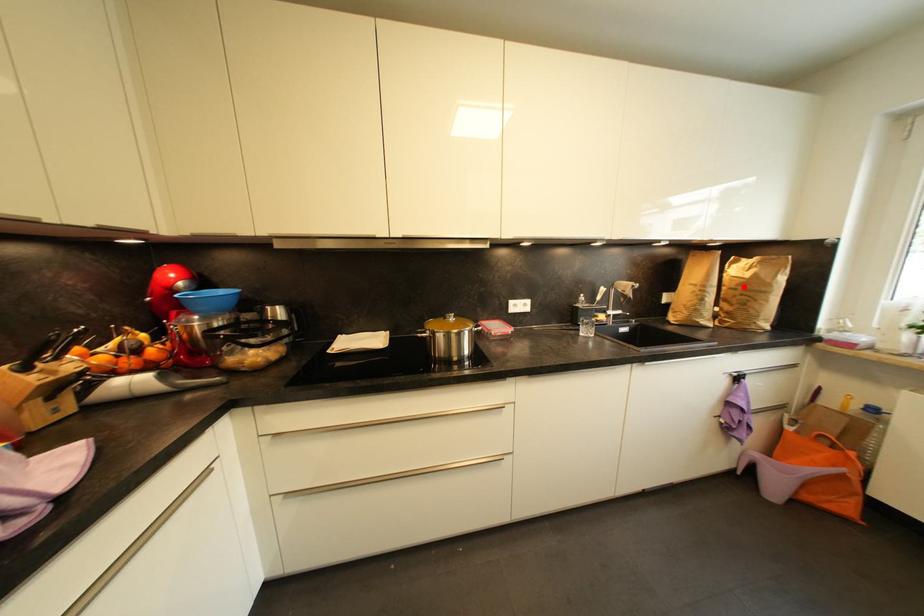
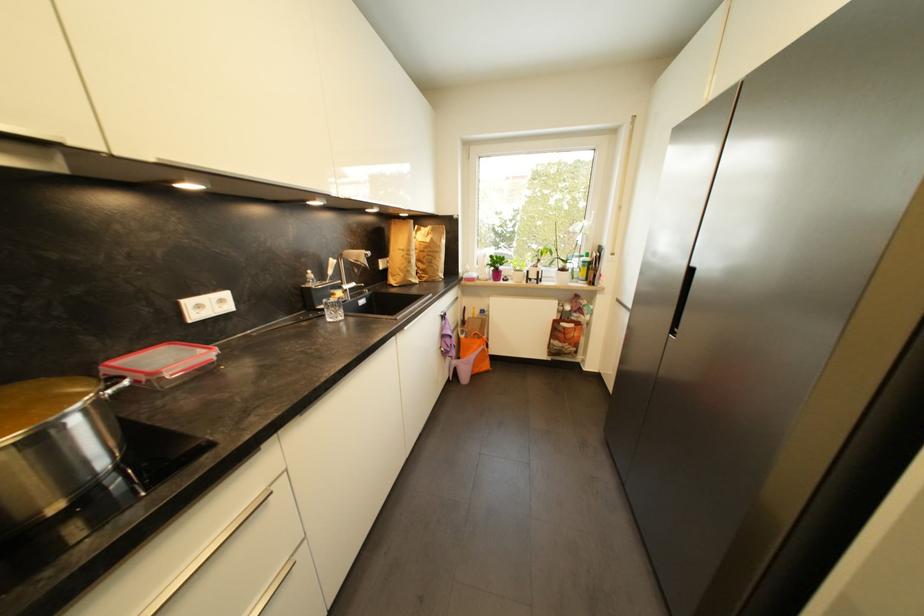
Question: I am providing you with two images of the same scene from different viewpoints. Image1 has a red point marked. In image2, the corresponding 3D location appears at what relative position? Reply with the corresponding letter.

Choices:
 (A) Closer
 (B) Farther

Answer: (A)